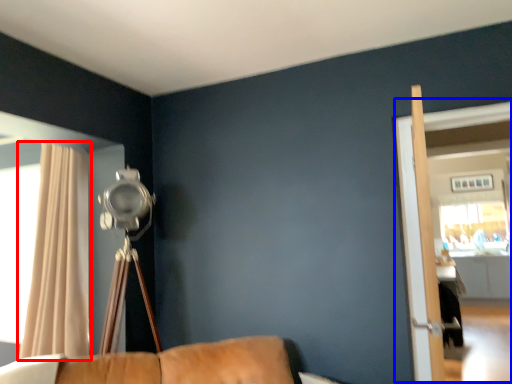
Question: Among these objects, which one is nearest to the camera, curtain (highlighted by a red box) or screen door (highlighted by a blue box)?

Choices:
 (A) curtain
 (B) screen door

Answer: (B)